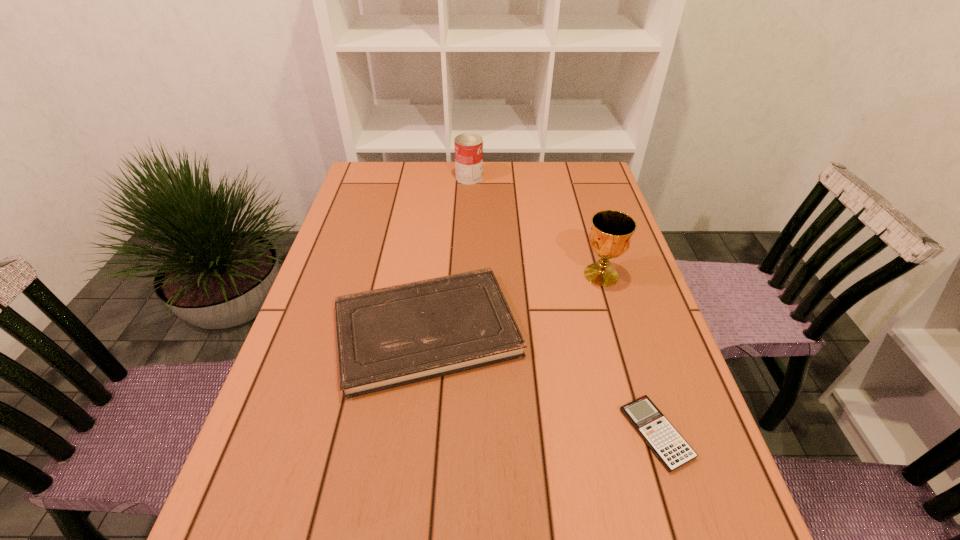
Find the location of a particular element. object positioned at the left edge is located at coordinates (389, 337).

Locate an element on the screen. Image resolution: width=960 pixels, height=540 pixels. chalice that is positioned at the right edge is located at coordinates pos(610,237).

Find the location of `calculator positioned at the right edge`. calculator positioned at the right edge is located at coordinates (667, 444).

Locate an element on the screen. free point at the far edge is located at coordinates (537, 176).

Identify the location of blank space at the left edge. (313, 356).

Identify the location of vacant space at the right edge of the desktop. (615, 290).

In the image, there is a desktop. What are the coordinates of `vacant space at the far left corner` in the screenshot? It's located at (386, 175).

The height and width of the screenshot is (540, 960). In order to click on vacant space at the far right corner in this screenshot , I will do `click(599, 170)`.

Locate an element on the screen. vacant space that is in between the chalice and the second tallest object is located at coordinates (536, 226).

At what (x,y) coordinates should I click in order to perform the action: click on free space between the can and the second shortest object. Please return your answer as a coordinate pair (x, y). The width and height of the screenshot is (960, 540). Looking at the image, I should click on (448, 254).